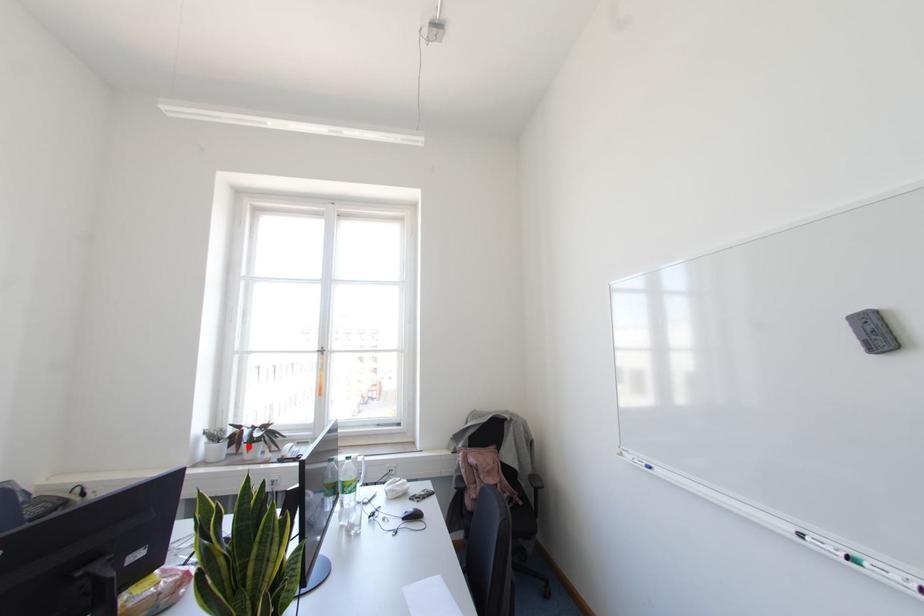
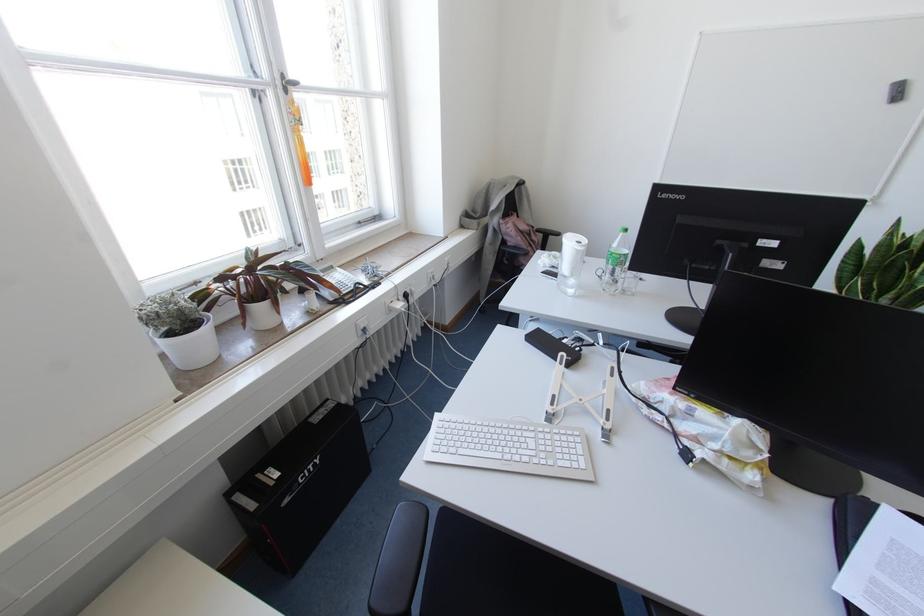
The point at the highlighted location is marked in the first image. Where is the corresponding point in the second image?

(274, 302)